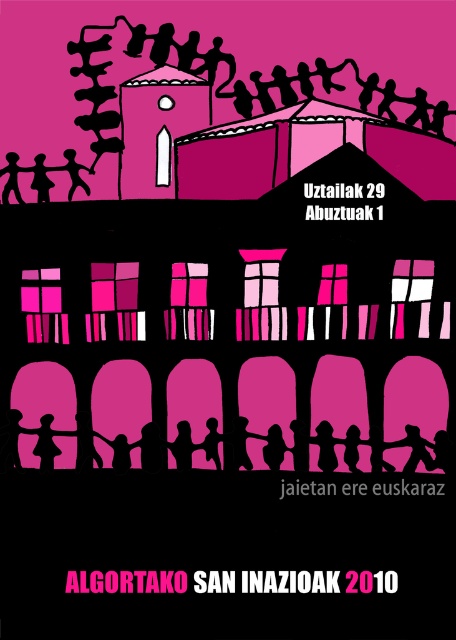
Question: Which point is closer to the camera?

Choices:
 (A) matte black figure at upper left
 (B) silhouette figure at lower center

Answer: (B)

Question: Which of the following is the closest to the observer?

Choices:
 (A) silhouette figure at lower center
 (B) matte black figure at upper left

Answer: (A)

Question: Can you confirm if silhouette figure at lower center is thinner than matte black figure at upper left?

Choices:
 (A) yes
 (B) no

Answer: (B)

Question: Which object is closer to the camera taking this photo?

Choices:
 (A) silhouette figure at lower center
 (B) matte black figure at upper left

Answer: (A)

Question: Where is silhouette figure at lower center located in relation to matte black figure at upper left in the image?

Choices:
 (A) right
 (B) left

Answer: (A)

Question: Considering the relative positions of silhouette figure at lower center and matte black figure at upper left in the image provided, where is silhouette figure at lower center located with respect to matte black figure at upper left?

Choices:
 (A) below
 (B) above

Answer: (A)